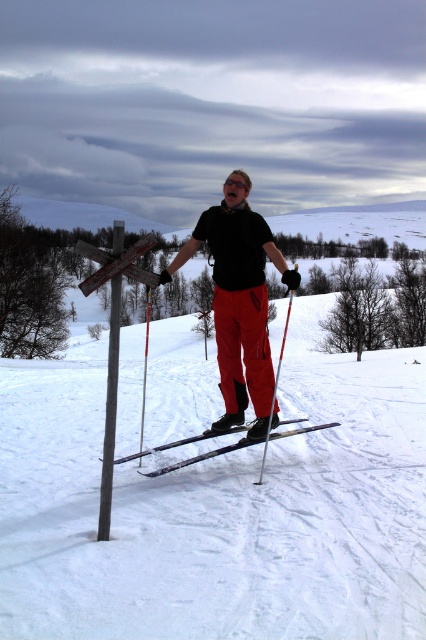
You are a photographer trying to capture the skier in the image. You want to position your camera so that both point (241, 173) and point (198, 436) are visible in the frame. Since you can only focus on one point clearly, which point should you focus on to ensure the other point remains in the background?

You should focus on point (241, 173) because it is closer to the viewer than point (198, 436), so the latter will naturally appear in the background.